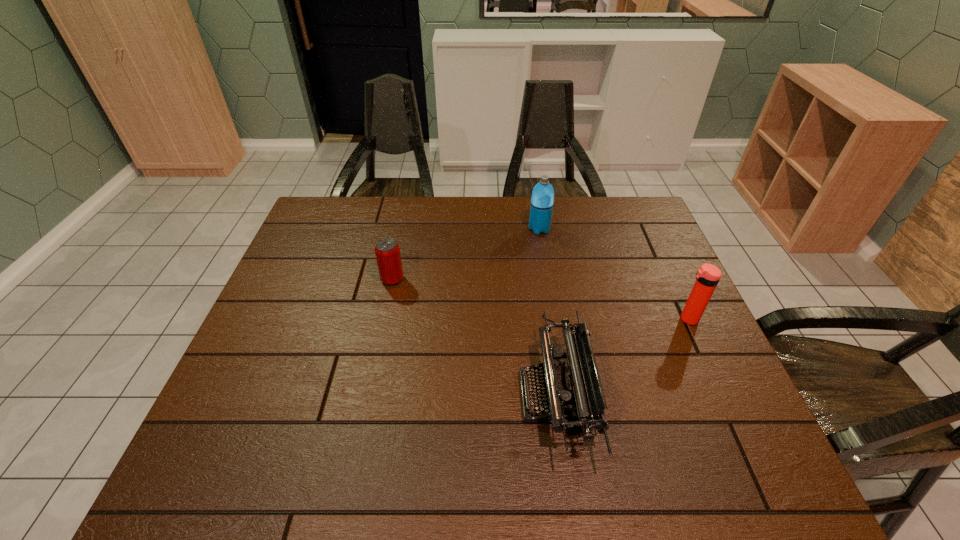
In the image, there is a desktop. Where is `vacant region at the far right corner`? The image size is (960, 540). vacant region at the far right corner is located at coordinates (608, 236).

Where is `free spot between the farthest object and the second farthest object`? This screenshot has height=540, width=960. free spot between the farthest object and the second farthest object is located at coordinates (466, 254).

At what (x,y) coordinates should I click in order to perform the action: click on free space between the typewriter and the farthest object. Please return your answer as a coordinate pair (x, y). The width and height of the screenshot is (960, 540). Looking at the image, I should click on (547, 313).

The width and height of the screenshot is (960, 540). What are the coordinates of `empty location between the nearest object and the second farthest object` in the screenshot? It's located at (474, 338).

At what (x,y) coordinates should I click in order to perform the action: click on free space between the typewriter and the third farthest object. Please return your answer as a coordinate pair (x, y). Looking at the image, I should click on (622, 357).

Locate an element on the screen. This screenshot has width=960, height=540. free space between the second nearest object and the nearest object is located at coordinates (622, 357).

Locate an element on the screen. Image resolution: width=960 pixels, height=540 pixels. empty space between the second farthest object and the farthest object is located at coordinates (466, 254).

Find the location of a particular element. The image size is (960, 540). vacant space in between the farther thermos bottle and the right thermos bottle is located at coordinates [613, 274].

The image size is (960, 540). I want to click on free space that is in between the leftmost object and the right thermos bottle, so click(x=540, y=299).

What are the coordinates of `vacant region between the farther thermos bottle and the nearer thermos bottle` in the screenshot? It's located at (613, 274).